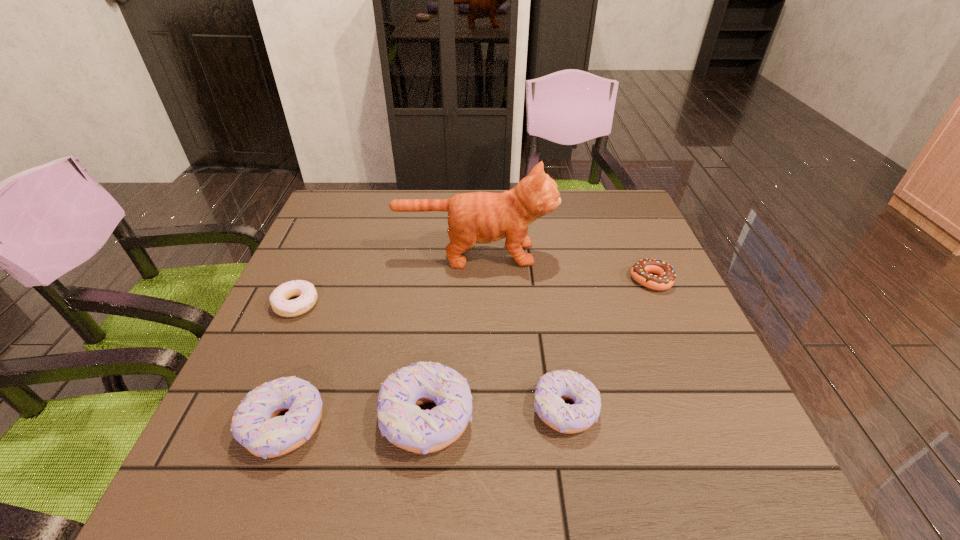
All doughnuts are currently evenly spaced. To continue this pattern, where would you add another doughnut on the right? Please point out a vacant spot. Please provide its 2D coordinates. Your answer should be formatted as a tuple, i.e. [(x, y)], where the tuple contains the x and y coordinates of a point satisfying the conditions above.

[(699, 401)]